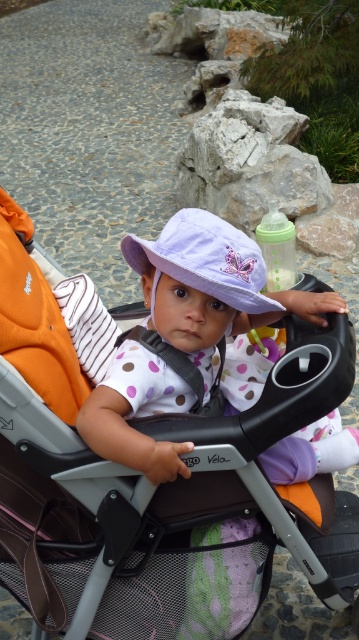
You are a parent trying to decide which hat to place on your child. You have two options in the image, the matte white hat at center and the lavender fabric hat at center. Based on their positions, which hat is located to the right?

The matte white hat at center is positioned on the right side of lavender fabric hat at center, so the matte white hat at center is the one located to the right.

You are a photographer trying to capture a clear photo of the orange fabric stroller at center and the lavender fabric hat at center. Which object should you focus on first if you want to ensure both are in focus without moving the camera?

You should focus on the orange fabric stroller at center first because it is positioned under the lavender fabric hat at center, meaning it is closer to the camera. By focusing on the closer object, the farther one may still be in the depth of field.